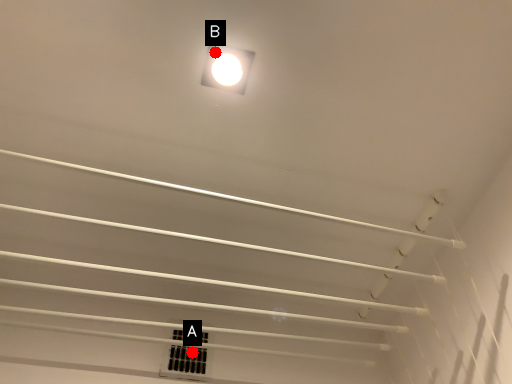
Question: Two points are circled on the image, labeled by A and B beside each circle. Which point is farther to the camera?

Choices:
 (A) A is further
 (B) B is further

Answer: (A)